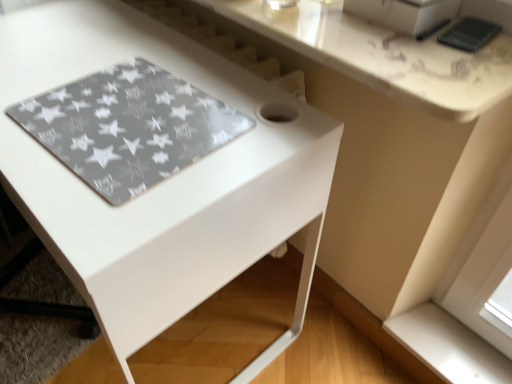
Question: Is white smooth window sill at lower right positioned before transparent star-patterned mat at lower left?

Choices:
 (A) no
 (B) yes

Answer: (A)

Question: Does white smooth window sill at lower right have a lesser width compared to transparent star-patterned mat at lower left?

Choices:
 (A) yes
 (B) no

Answer: (A)

Question: Considering the relative positions of white smooth window sill at lower right and transparent star-patterned mat at lower left in the image provided, is white smooth window sill at lower right behind transparent star-patterned mat at lower left?

Choices:
 (A) no
 (B) yes

Answer: (B)

Question: From a real-world perspective, is white smooth window sill at lower right on top of transparent star-patterned mat at lower left?

Choices:
 (A) yes
 (B) no

Answer: (B)

Question: From the image's perspective, does white smooth window sill at lower right appear higher than transparent star-patterned mat at lower left?

Choices:
 (A) no
 (B) yes

Answer: (A)

Question: From a real-world perspective, is white glossy table at center above or below black matte phone at upper right?

Choices:
 (A) below
 (B) above

Answer: (A)

Question: Is point (132, 289) positioned closer to the camera than point (439, 36)?

Choices:
 (A) closer
 (B) farther

Answer: (A)

Question: In the image, is white glossy table at center on the left side or the right side of black matte phone at upper right?

Choices:
 (A) left
 (B) right

Answer: (A)

Question: Is white glossy table at center in front of or behind black matte phone at upper right in the image?

Choices:
 (A) front
 (B) behind

Answer: (A)

Question: Is white smooth window sill at lower right bigger or smaller than white glossy table at center?

Choices:
 (A) big
 (B) small

Answer: (B)

Question: From the image's perspective, is white smooth window sill at lower right located above or below white glossy table at center?

Choices:
 (A) below
 (B) above

Answer: (A)

Question: Is white smooth window sill at lower right in front of or behind white glossy table at center in the image?

Choices:
 (A) front
 (B) behind

Answer: (B)

Question: Considering the positions of point (429, 365) and point (99, 243), is point (429, 365) closer or farther from the camera than point (99, 243)?

Choices:
 (A) closer
 (B) farther

Answer: (B)

Question: Does point (317, 38) appear closer or farther from the camera than point (509, 377)?

Choices:
 (A) farther
 (B) closer

Answer: (B)

Question: Is white glossy counter top at upper center inside the boundaries of white smooth window sill at lower right, or outside?

Choices:
 (A) inside
 (B) outside

Answer: (B)